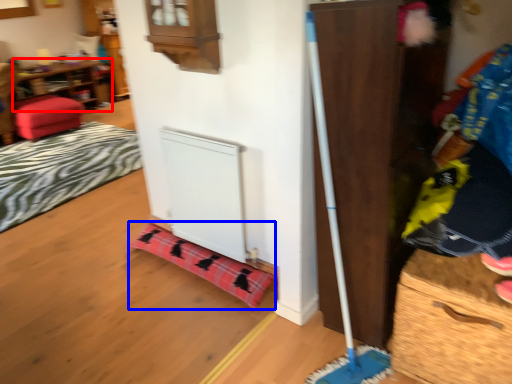
Question: Which of the following is the closest to the observer, shelf (highlighted by a red box) or blanket (highlighted by a blue box)?

Choices:
 (A) shelf
 (B) blanket

Answer: (B)